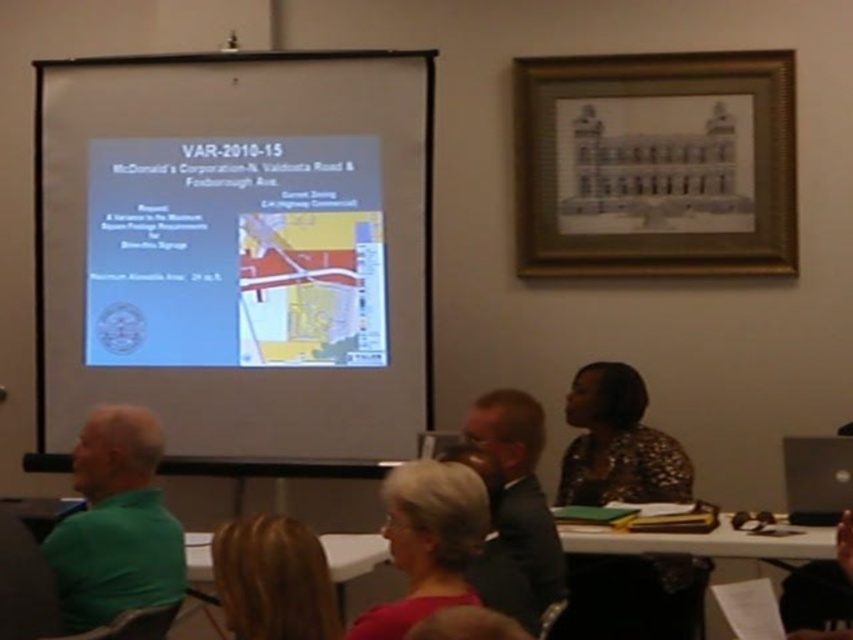
Question: Is white matte projection screen at upper center wider than blonde hair at lower center?

Choices:
 (A) no
 (B) yes

Answer: (B)

Question: Which point appears closest to the camera in this image?

Choices:
 (A) [x=541, y=531]
 (B) [x=231, y=336]
 (C) [x=386, y=308]

Answer: (A)

Question: Is white matte projection screen at upper center positioned in front of matte white projector screen at upper center?

Choices:
 (A) no
 (B) yes

Answer: (B)

Question: Which point is farther to the camera?

Choices:
 (A) matte white projector screen at upper center
 (B) gray hair at center
 (C) black plastic laptop at lower right
 (D) blonde hair at lower center

Answer: (A)

Question: Is gray hair at center closer to camera compared to black plastic laptop at lower right?

Choices:
 (A) yes
 (B) no

Answer: (A)

Question: Which object appears farthest from the camera in this image?

Choices:
 (A) blonde hair at lower center
 (B) green matte shirt at left
 (C) matte white projector screen at upper center

Answer: (C)